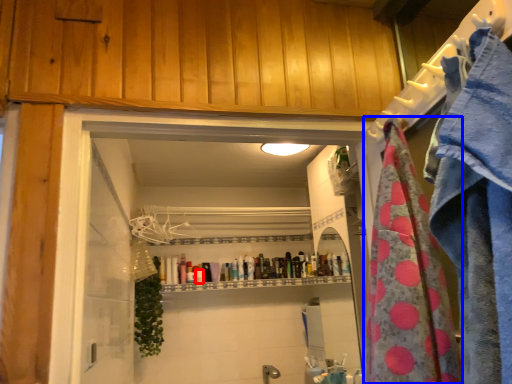
Question: Which of the following is the closest to the observer, toiletry (highlighted by a red box) or beach towel (highlighted by a blue box)?

Choices:
 (A) toiletry
 (B) beach towel

Answer: (B)